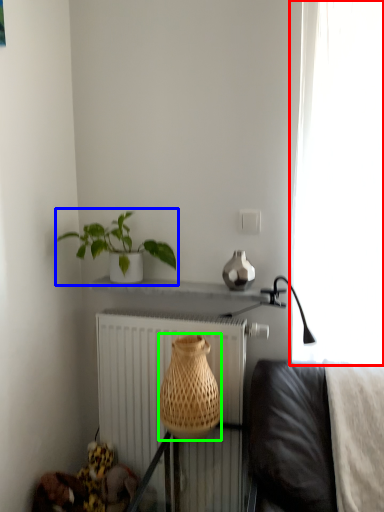
Question: Based on their relative distances, which object is farther from curtain (highlighted by a red box)? Choose from houseplant (highlighted by a blue box) and basket (highlighted by a green box).

Choices:
 (A) houseplant
 (B) basket

Answer: (A)